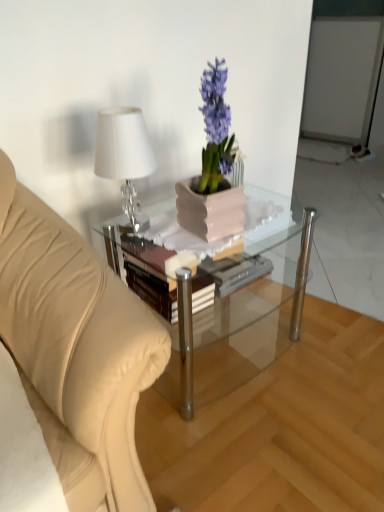
Locate an element on the screen. The width and height of the screenshot is (384, 512). vacant space in front of clear glass coffee table at center is located at coordinates (247, 440).